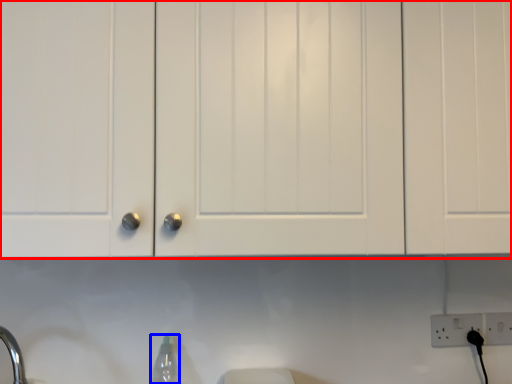
Question: Which object appears farthest to the camera in this image, cabinetry (highlighted by a red box) or bottle (highlighted by a blue box)?

Choices:
 (A) cabinetry
 (B) bottle

Answer: (B)